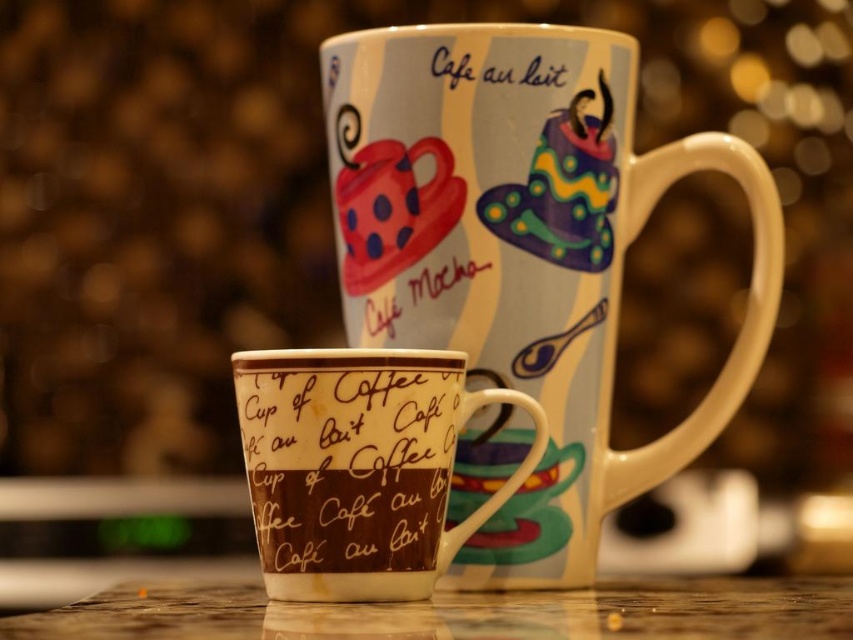
Looking at this image, is matte ceramic mug at center bigger than wooden table at lower center?

No, matte ceramic mug at center is not bigger than wooden table at lower center.

Who is more distant from viewer, (380, 80) or (74, 628)?

The point (380, 80) is behind.

Is point (614, 106) less distant than point (386, 624)?

That is False.

This screenshot has height=640, width=853. I want to click on matte ceramic mug at center, so click(523, 257).

Does brown matte cup of coffee at center lie in front of matte white text at upper center?

Yes, it is.

Does point (440, 472) come farther from viewer compared to point (525, 77)?

That is False.

The image size is (853, 640). In order to click on brown matte cup of coffee at center in this screenshot , I will do `click(347, 464)`.

Consider the image. How far apart are wooden table at lower center and matte white text at upper center?

wooden table at lower center and matte white text at upper center are 16.12 inches apart.

Consider the image. Is wooden table at lower center shorter than matte white text at upper center?

No.

Where is `wooden table at lower center`? wooden table at lower center is located at coordinates (460, 612).